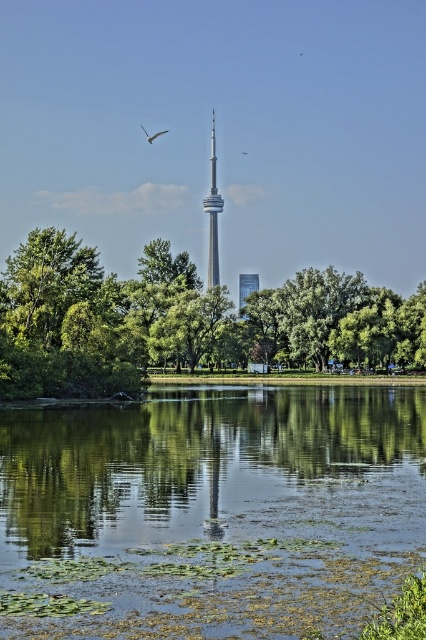
Question: Which of the following is the closest to the observer?

Choices:
 (A) white glossy bird at upper center
 (B) green algae-covered water at center
 (C) smooth glass tower at center
 (D) green leafy tree at center

Answer: (B)

Question: Which point is farther from the camera taking this photo?

Choices:
 (A) (270, 616)
 (B) (244, 152)

Answer: (B)

Question: Is green algae-covered water at center to the left of white glossy bird at upper center from the viewer's perspective?

Choices:
 (A) yes
 (B) no

Answer: (B)

Question: Is green algae-covered water at center positioned at the back of green leafy tree at center?

Choices:
 (A) no
 (B) yes

Answer: (A)

Question: Among these objects, which one is farthest from the camera?

Choices:
 (A) silver metallic tower at center
 (B) white glossy bird at upper center
 (C) green algae-covered water at center
 (D) white feathered bird at upper center

Answer: (B)

Question: Does smooth glass tower at center appear on the left side of white feathered bird at upper center?

Choices:
 (A) yes
 (B) no

Answer: (A)